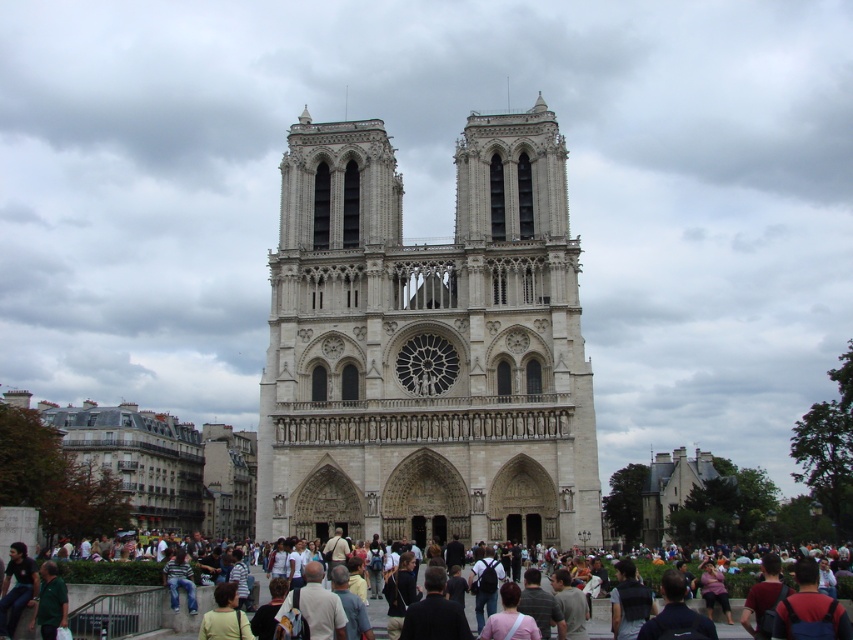
You are standing in front of the Notre Dame Cathedral and want to take a photo. You notice two points marked on the cathedral facade at coordinates point (508, 253) and point (192, 620). Which point is closer to your camera lens?

Point (508, 253) is further to the camera than point (192, 620), so the point closer to the camera lens is point (192, 620).

You are standing in front of the Notre Dame Cathedral. If you want to take a photo of the central rose window, which is part of the white stone cathedral at center, where should you position yourself relative to the cathedral?

The white stone cathedral at center is located at point (427, 346), so you should position yourself directly in front of the central area to capture the rose window effectively.